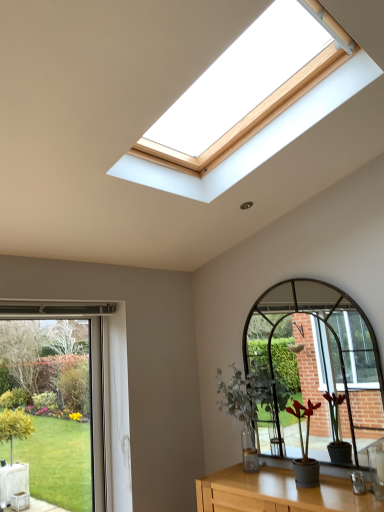
I want to click on vacant space underneath green matte plant at center, which is counted as the 1th houseplant, starting from the right (from a real-world perspective), so click(x=304, y=486).